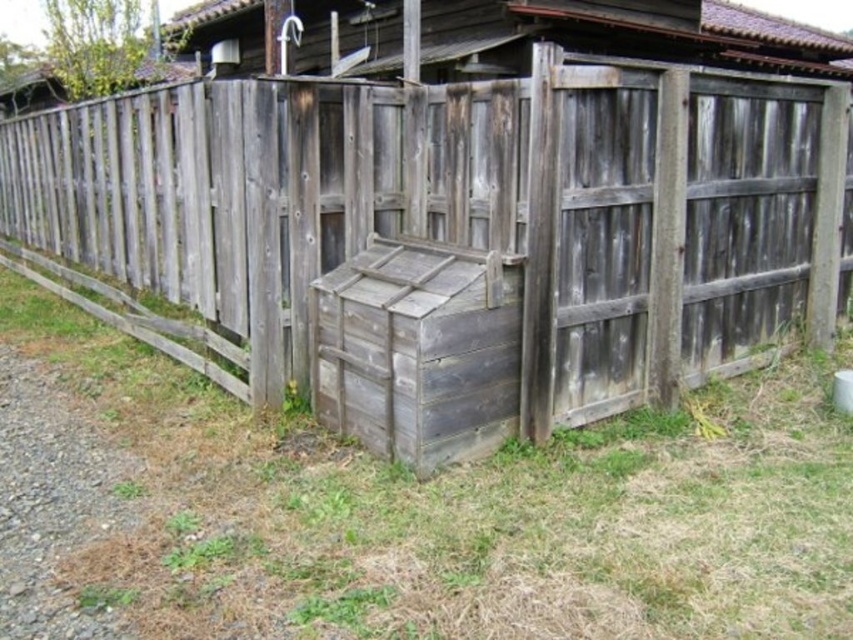
Is weathered wood fence at center behind weathered wood crate at center?

Yes, it is behind weathered wood crate at center.

Who is lower down, weathered wood fence at center or weathered wood crate at center?

weathered wood crate at center

This screenshot has height=640, width=853. In order to click on weathered wood fence at center in this screenshot , I will do `click(456, 234)`.

Looking at this image, is green grass at lower center thinner than weathered wood crate at center?

No, green grass at lower center is not thinner than weathered wood crate at center.

Can you confirm if green grass at lower center is positioned above weathered wood crate at center?

No.

This screenshot has width=853, height=640. What are the coordinates of `green grass at lower center` in the screenshot? It's located at (469, 509).

Who is more forward, (x=602, y=380) or (x=695, y=570)?

Point (x=695, y=570) is more forward.

Who is more distant from viewer, (131, 328) or (152, 477)?

The point (131, 328) is behind.

This screenshot has width=853, height=640. What are the coordinates of `weathered wood fence at center` in the screenshot? It's located at (456, 234).